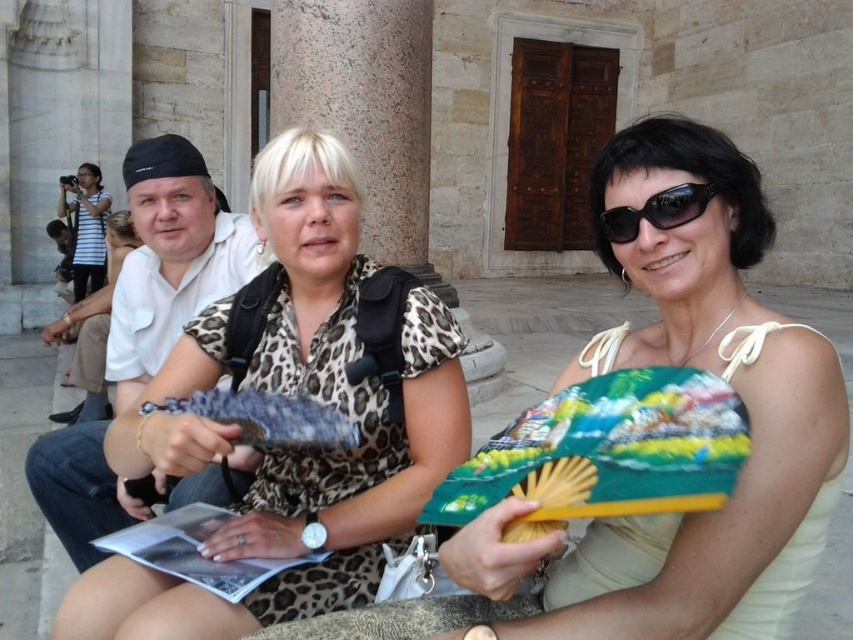
You are standing at the center of the plaza and want to take a photo that includes both the white cotton shirt at upper left and the black plastic sunglasses at upper right. The camera you have can focus on objects within a 5 meter range. Will both subjects be in focus?

The white cotton shirt at upper left is 5.14 meters from black plastic sunglasses at upper right. Since the distance between them is slightly over 5 meters, the camera might not be able to keep both in focus simultaneously if the depth of field is limited. However, if the camera allows adjusting focus or uses a wide aperture to increase depth of field, it might still work. Alternatively, moving closer to reduce the distance between the subjects could help ensure both are in focus.

You are a tailor who needs to determine which shirt requires more fabric between the white cotton shirt at upper left and the striped cotton shirt at upper left based on their widths. Which one needs more fabric?

The striped cotton shirt at upper left requires more fabric because its width is greater than the white cotton shirt at upper left.

You are standing in the plaza and want to know if the beige fabric fan at center and the white leopard print dress at center are close enough to be in the same photo. The camera you have can capture objects within a 10 meter range. Can both be included in a single photo?

The beige fabric fan at center and the white leopard print dress at center are 11.46 meters apart. Since the camera can only capture objects within 10 meters, they cannot both be included in a single photo.